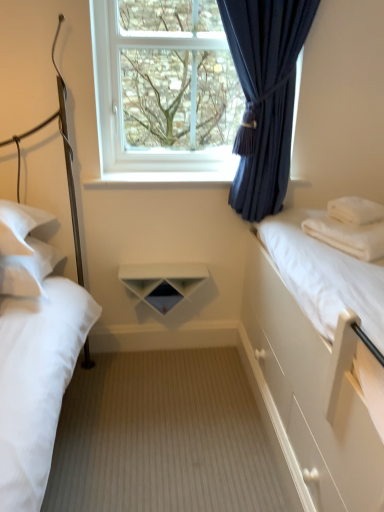
Question: Choose the correct answer: Is white soft pillow at right, the 2th pillow when ordered from left to right, inside wooden floor at center or outside it?

Choices:
 (A) inside
 (B) outside

Answer: (B)

Question: Considering the positions of white soft pillow at right, marked as the second pillow in a right-to-left arrangement, and wooden floor at center in the image, is white soft pillow at right, marked as the second pillow in a right-to-left arrangement, wider or thinner than wooden floor at center?

Choices:
 (A) thin
 (B) wide

Answer: (A)

Question: Which is nearer to the white glossy shelf at center?

Choices:
 (A) transparent glass window at upper center
 (B) white soft pillow at left, which ranks as the first pillow in left-to-right order
 (C) white soft pillow at right, the 1th pillow in the right-to-left sequence
 (D) white smooth bed at right, which is counted as the 1th bed, starting from the right
 (E) white matte shelf at center

Answer: (A)

Question: Which object is the farthest from the white matte shelf at center?

Choices:
 (A) white glossy shelf at center
 (B) white soft pillow at right, the 2th pillow when ordered from left to right
 (C) wooden floor at center
 (D) white soft pillow at left, which ranks as the first pillow in left-to-right order
 (E) white smooth bed at right, which is counted as the 1th bed, starting from the right

Answer: (B)